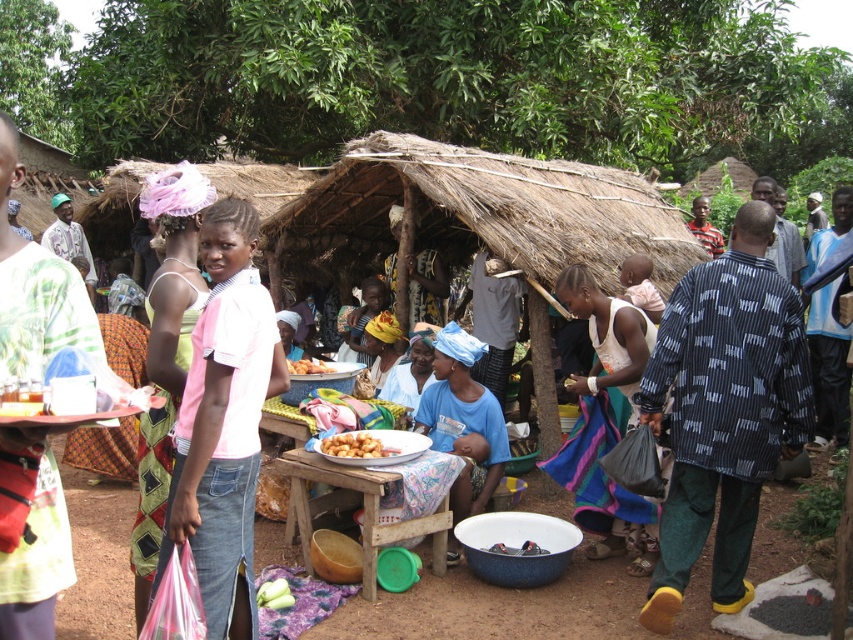
What do you see at coordinates (518, 548) in the screenshot?
I see `smooth plastic bowl at center` at bounding box center [518, 548].

Is point (523, 550) positioned after point (293, 364)?

No, (523, 550) is in front of (293, 364).

The image size is (853, 640). In order to click on smooth plastic bowl at center in this screenshot , I will do click(x=518, y=548).

Who is positioned more to the right, pink cotton shirt at center or white cotton dress at center?

From the viewer's perspective, white cotton dress at center appears more on the right side.

Between point (202, 332) and point (550, 458), which one is positioned in front?

Point (202, 332) is in front.

Who is more distant from viewer, (190, 378) or (608, 502)?

The point (608, 502) is more distant.

Where is `pink cotton shirt at center`? This screenshot has height=640, width=853. pink cotton shirt at center is located at coordinates pos(224,422).

Can you confirm if pink cotton shirt at center is positioned to the right of pink fabric headscarf at upper left?

Correct, you'll find pink cotton shirt at center to the right of pink fabric headscarf at upper left.

This screenshot has width=853, height=640. Identify the location of pink cotton shirt at center. (224, 422).